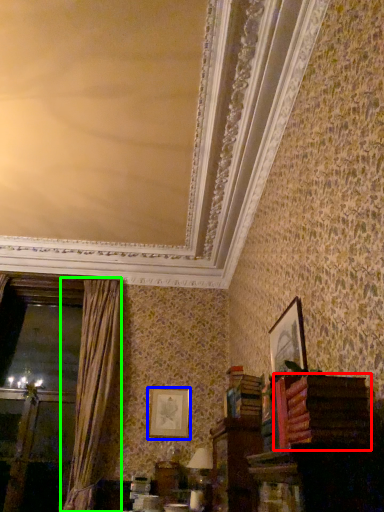
Question: Estimate the real-world distances between objects in this image. Which object is farther from book (highlighted by a red box), picture frame (highlighted by a blue box) or curtain (highlighted by a green box)?

Choices:
 (A) picture frame
 (B) curtain

Answer: (B)